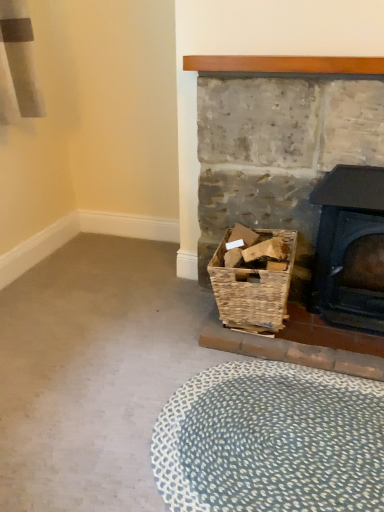
The image size is (384, 512). What do you see at coordinates (350, 248) in the screenshot? I see `black cast iron wood burning stove at right` at bounding box center [350, 248].

I want to click on woven brown basket at lower right, so click(253, 286).

The height and width of the screenshot is (512, 384). Find the location of `black cast iron wood burning stove at right`. black cast iron wood burning stove at right is located at coordinates (350, 248).

You are a GUI agent. You are given a task and a screenshot of the screen. Output one action in this format:
    pyautogui.click(x=<x>, y=<y>)
    Task: Click on the plain that is below the black cast iron wood burning stove at right (from the image's perspective)
    This screenshot has height=512, width=384.
    Given the screenshot: What is the action you would take?
    pyautogui.click(x=271, y=441)

Considering the sizes of objects blue textured rug at lower center and black cast iron wood burning stove at right in the image provided, who is shorter, blue textured rug at lower center or black cast iron wood burning stove at right?

With less height is blue textured rug at lower center.

Which object is closer to the camera taking this photo, blue textured rug at lower center or black cast iron wood burning stove at right?

Positioned in front is blue textured rug at lower center.

How different are the orientations of blue textured rug at lower center and black cast iron wood burning stove at right in degrees?

The angular difference between blue textured rug at lower center and black cast iron wood burning stove at right is 0.316 degrees.

I want to click on fireplace positioned vertically above the blue textured rug at lower center (from a real-world perspective), so click(307, 346).

Does point (279, 482) appear closer or farther from the camera than point (283, 359)?

Clearly, point (279, 482) is closer to the camera than point (283, 359).

Is blue textured rug at lower center surrounding rustic wicker basket at lower right?

Actually, rustic wicker basket at lower right is outside blue textured rug at lower center.

Considering the positions of objects blue textured rug at lower center and rustic wicker basket at lower right in the image provided, who is more to the left, blue textured rug at lower center or rustic wicker basket at lower right?

From the viewer's perspective, blue textured rug at lower center appears more on the left side.

Who is taller, blue textured rug at lower center or woven brown basket at lower right?

Standing taller between the two is woven brown basket at lower right.

Could you tell me if blue textured rug at lower center is facing woven brown basket at lower right?

No, blue textured rug at lower center is not turned towards woven brown basket at lower right.

Consider the image. From the image's perspective, is blue textured rug at lower center beneath woven brown basket at lower right?

Yes.

Does point (330, 312) come closer to viewer compared to point (282, 288)?

That is False.

At what (x,y) coordinates should I click in order to perform the action: click on wood burning stove located in front of the woven brown basket at lower right. Please return your answer as a coordinate pair (x, y). The height and width of the screenshot is (512, 384). Looking at the image, I should click on (350, 248).

Between black cast iron wood burning stove at right and woven brown basket at lower right, which one is positioned behind?

woven brown basket at lower right.

Considering the sizes of objects black cast iron wood burning stove at right and woven brown basket at lower right in the image provided, who is taller, black cast iron wood burning stove at right or woven brown basket at lower right?

black cast iron wood burning stove at right is taller.

Considering the sizes of rustic wicker basket at lower right and blue textured rug at lower center in the image, is rustic wicker basket at lower right wider or thinner than blue textured rug at lower center?

Considering their sizes, rustic wicker basket at lower right looks slimmer than blue textured rug at lower center.

Locate an element on the screen. This screenshot has height=512, width=384. plain that appears on the left of rustic wicker basket at lower right is located at coordinates (271, 441).

In the scene shown: How many degrees apart are the facing directions of rustic wicker basket at lower right and blue textured rug at lower center?

They differ by 1.33 degrees in their facing directions.

Between rustic wicker basket at lower right and blue textured rug at lower center, which one has smaller size?

blue textured rug at lower center.

Would you say woven brown basket at lower right is part of rustic wicker basket at lower right's contents?

No, woven brown basket at lower right is located outside of rustic wicker basket at lower right.

Between rustic wicker basket at lower right and woven brown basket at lower right, which one appears on the left side from the viewer's perspective?

From the viewer's perspective, woven brown basket at lower right appears more on the left side.

Is point (331, 362) positioned in front of point (268, 323)?

Yes, point (331, 362) is closer to viewer.

Which of these two, rustic wicker basket at lower right or woven brown basket at lower right, is wider?

woven brown basket at lower right.

From the image's perspective, is woven brown basket at lower right under rustic wicker basket at lower right?

Yes, from the image's perspective, woven brown basket at lower right is beneath rustic wicker basket at lower right.

Between woven brown basket at lower right and rustic wicker basket at lower right, which one has smaller size?

woven brown basket at lower right is smaller.

Find the location of a particular element. The image size is (384, 512). fireplace in front of the woven brown basket at lower right is located at coordinates (307, 346).

Identify the location of wood burning stove above the blue textured rug at lower center (from the image's perspective). The height and width of the screenshot is (512, 384). (350, 248).

In order to click on fireplace on the right side of blue textured rug at lower center in this screenshot , I will do `click(307, 346)`.

Based on their spatial positions, is black cast iron wood burning stove at right or blue textured rug at lower center closer to woven brown basket at lower right?

Based on the image, black cast iron wood burning stove at right appears to be nearer to woven brown basket at lower right.

When comparing their distances from rustic wicker basket at lower right, does black cast iron wood burning stove at right or blue textured rug at lower center seem further?

blue textured rug at lower center is positioned further to the anchor rustic wicker basket at lower right.

Which object lies further to the anchor point rustic wicker basket at lower right, blue textured rug at lower center or woven brown basket at lower right?

blue textured rug at lower center is positioned further to the anchor rustic wicker basket at lower right.

Estimate the real-world distances between objects in this image. Which object is closer to woven brown basket at lower right, black cast iron wood burning stove at right or rustic wicker basket at lower right?

rustic wicker basket at lower right.

When comparing their distances from rustic wicker basket at lower right, does black cast iron wood burning stove at right or woven brown basket at lower right seem closer?

woven brown basket at lower right.

Considering their positions, is woven brown basket at lower right positioned closer to rustic wicker basket at lower right than blue textured rug at lower center?

woven brown basket at lower right is positioned closer to the anchor rustic wicker basket at lower right.

Which object lies further to the anchor point woven brown basket at lower right, blue textured rug at lower center or black cast iron wood burning stove at right?

blue textured rug at lower center is further to woven brown basket at lower right.

Considering their positions, is black cast iron wood burning stove at right positioned closer to blue textured rug at lower center than rustic wicker basket at lower right?

rustic wicker basket at lower right is closer to blue textured rug at lower center.

The image size is (384, 512). Find the location of `basket between black cast iron wood burning stove at right and blue textured rug at lower center in the up-down direction`. basket between black cast iron wood burning stove at right and blue textured rug at lower center in the up-down direction is located at coordinates (253, 286).

You are a GUI agent. You are given a task and a screenshot of the screen. Output one action in this format:
    pyautogui.click(x=<x>, y=<y>)
    Task: Click on the fireplace between woven brown basket at lower right and black cast iron wood burning stove at right
    Image resolution: width=384 pixels, height=512 pixels.
    Given the screenshot: What is the action you would take?
    pyautogui.click(x=307, y=346)

Image resolution: width=384 pixels, height=512 pixels. Find the location of `wood burning stove between rustic wicker basket at lower right and blue textured rug at lower center in the vertical direction`. wood burning stove between rustic wicker basket at lower right and blue textured rug at lower center in the vertical direction is located at coordinates (350, 248).

Where is `basket between rustic wicker basket at lower right and blue textured rug at lower center in the vertical direction`? This screenshot has width=384, height=512. basket between rustic wicker basket at lower right and blue textured rug at lower center in the vertical direction is located at coordinates click(253, 286).